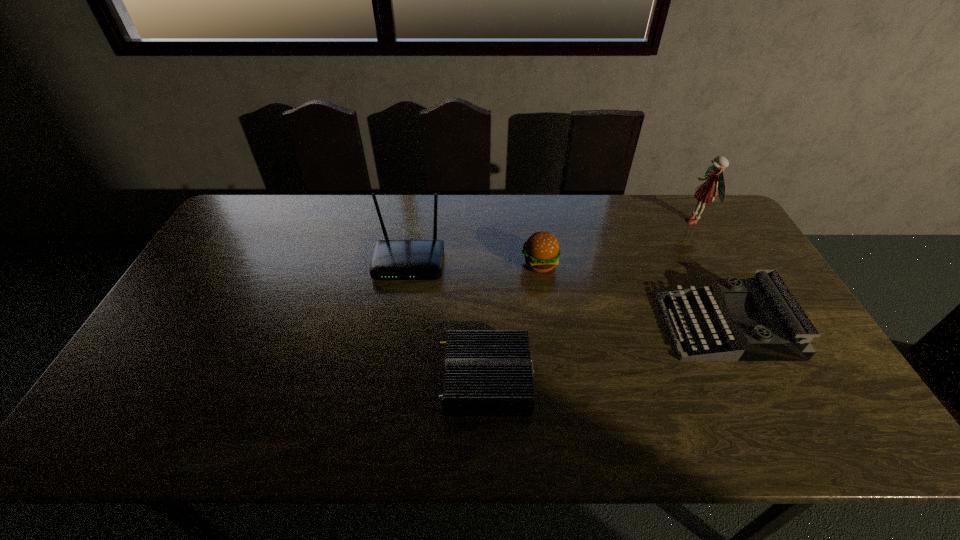
Image resolution: width=960 pixels, height=540 pixels. I want to click on vacant region between the second tallest object and the typewriter, so click(x=568, y=295).

The width and height of the screenshot is (960, 540). In order to click on free spot between the tallest object and the hamburger in this screenshot , I will do `click(617, 242)`.

Image resolution: width=960 pixels, height=540 pixels. What are the coordinates of `blank region between the shortest object and the farthest object` in the screenshot? It's located at (590, 300).

This screenshot has height=540, width=960. I want to click on free area in between the hamburger and the tallest object, so click(x=617, y=242).

Identify the location of vacant area that lies between the hamburger and the typewriter. (634, 295).

Identify the location of blank region between the shortest object and the tallest object. (590, 300).

What are the coordinates of `vacant point located between the hamburger and the shorter router` in the screenshot? It's located at (513, 322).

Find the location of a particular element. The height and width of the screenshot is (540, 960). free space between the nearer router and the taller router is located at coordinates (447, 322).

Locate an element on the screen. Image resolution: width=960 pixels, height=540 pixels. vacant space that's between the hamburger and the typewriter is located at coordinates (634, 295).

The image size is (960, 540). Identify the location of object that is the fourth closest to the typewriter. (392, 259).